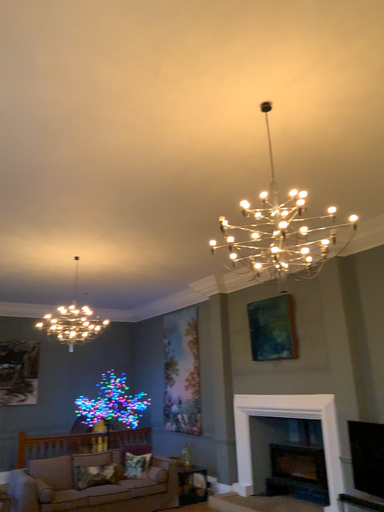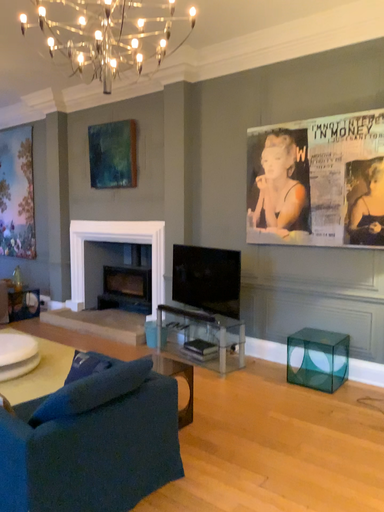
Question: Which way did the camera rotate in the video?

Choices:
 (A) rotated downward
 (B) rotated upward

Answer: (A)